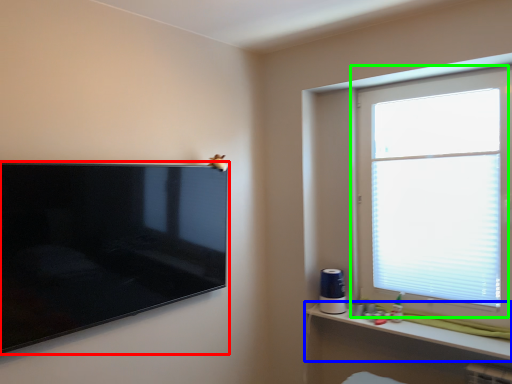
Question: Which object is positioned closest to television (highlighted by a red box)? Select from shelf (highlighted by a blue box) and window (highlighted by a green box).

Choices:
 (A) shelf
 (B) window

Answer: (A)